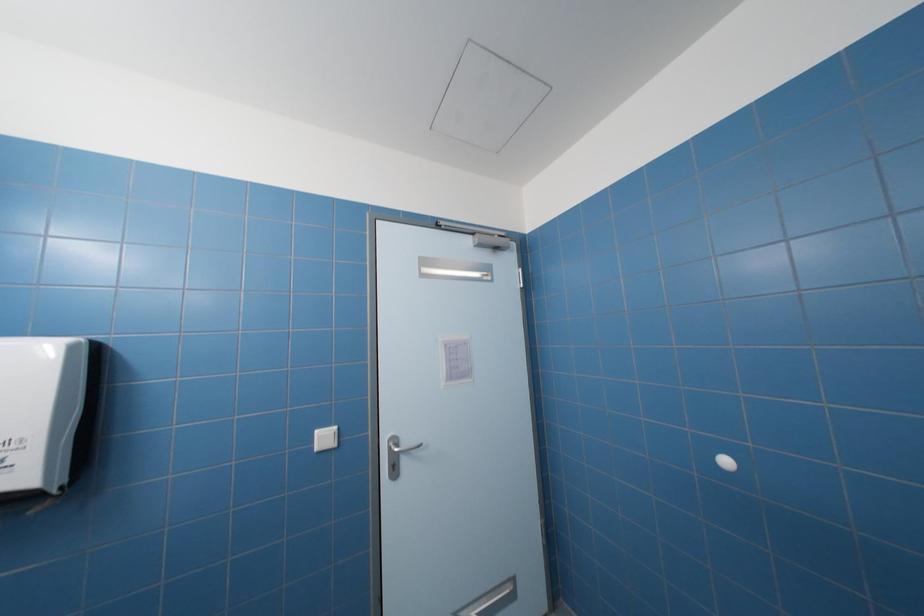
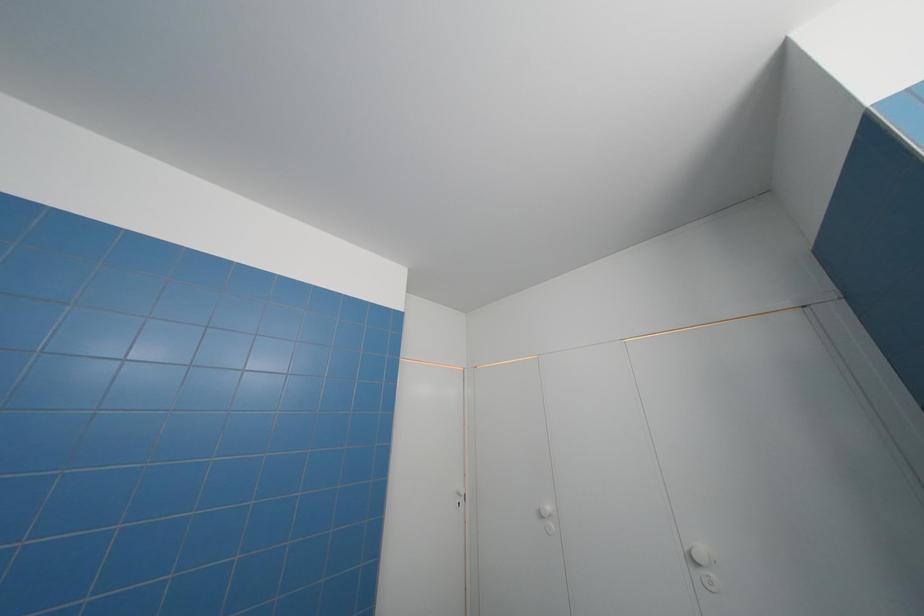
Based on the continuous images, in which direction is the camera rotating?

The camera's rotation is toward right-up.